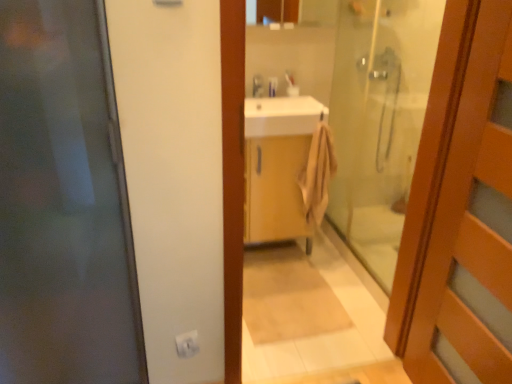
Where is `free space in front of wooden cabinet at center`? The image size is (512, 384). free space in front of wooden cabinet at center is located at coordinates (285, 285).